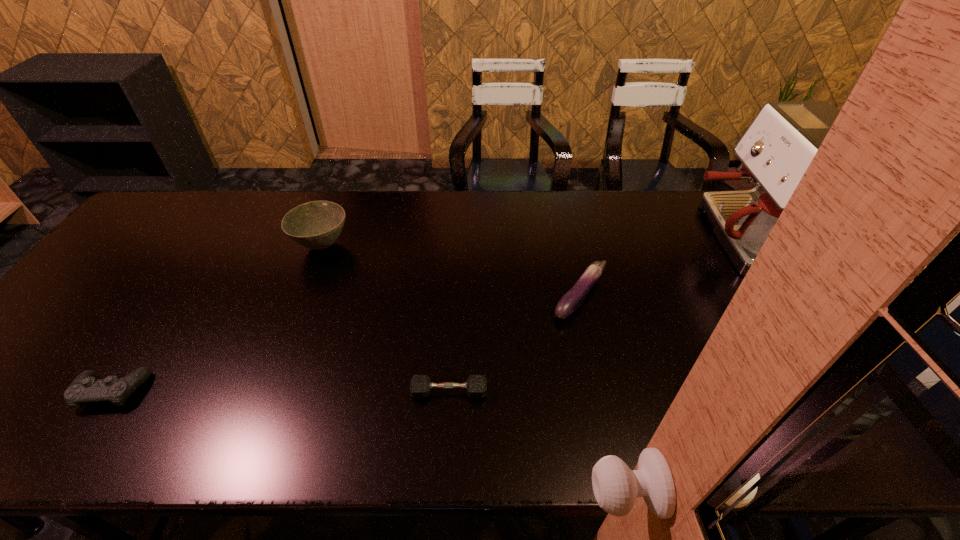
Identify the location of blank space located 0.300m on the front of the tallest object near the spout. The width and height of the screenshot is (960, 540). (595, 236).

Identify the location of free space located 0.260m on the left of the second tallest object. The image size is (960, 540). (207, 245).

Find the location of a particular element. The image size is (960, 540). free location located 0.320m on the right of the second object from right to left is located at coordinates (729, 297).

I want to click on vacant area situated 0.180m on the right of the leftmost object, so click(x=226, y=392).

Find the location of a particular element. The image size is (960, 540). free spot located on the back of the dumbbell is located at coordinates point(455,280).

The width and height of the screenshot is (960, 540). I want to click on coffee maker present at the far edge, so click(x=778, y=146).

At what (x,y) coordinates should I click in order to perform the action: click on bowl present at the far edge. Please return your answer as a coordinate pair (x, y). The image size is (960, 540). Looking at the image, I should click on (316, 225).

Locate an element on the screen. The width and height of the screenshot is (960, 540). object present at the near edge is located at coordinates (85, 388).

Where is `object that is at the right edge`? Image resolution: width=960 pixels, height=540 pixels. object that is at the right edge is located at coordinates (778, 146).

Image resolution: width=960 pixels, height=540 pixels. Identify the location of object that is positioned at the far right corner. pos(778,146).